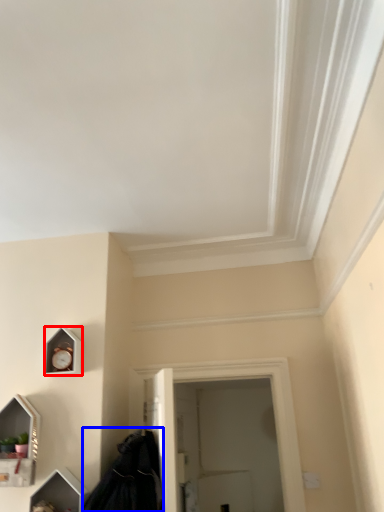
Question: Which point is further to the camera, clock (highlighted by a red box) or cloak (highlighted by a blue box)?

Choices:
 (A) clock
 (B) cloak

Answer: (A)